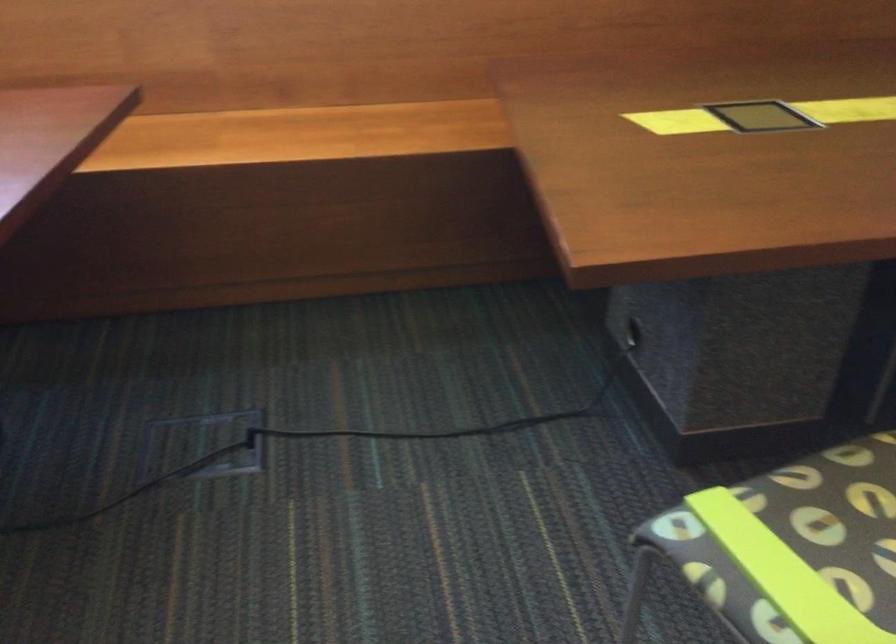
Find where to sit the patterned chair sitting surface. Please return your answer as a coordinate pair (x, y).

(871, 496)